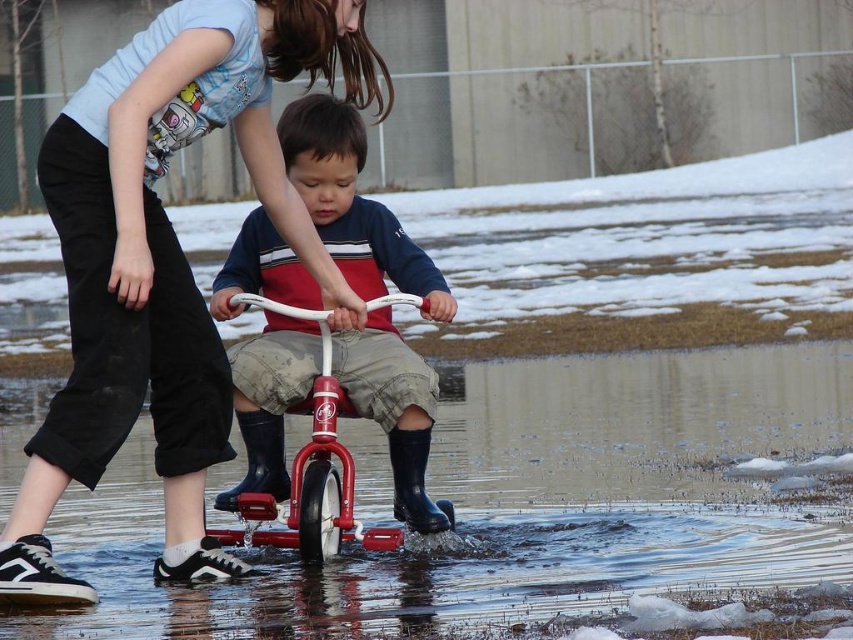
Is clear water at lower center above matte black pants at lower left?

No.

Which is more to the right, clear water at lower center or matte black pants at lower left?

clear water at lower center is more to the right.

Locate an element on the screen. clear water at lower center is located at coordinates (524, 504).

Locate an element on the screen. The image size is (853, 640). clear water at lower center is located at coordinates coord(524,504).

Between point (170, 241) and point (341, 499), which one is positioned behind?

Positioned behind is point (341, 499).

Is point (297, 220) behind point (260, 509)?

That is False.

The width and height of the screenshot is (853, 640). Find the location of `matte black pants at lower left`. matte black pants at lower left is located at coordinates (166, 259).

Between clear water at lower center and metallic red bicycle at center, which one has less height?

Standing shorter between the two is clear water at lower center.

Does point (334, 563) come farther from viewer compared to point (297, 506)?

Yes.

Is point (181, 632) closer to camera compared to point (328, 353)?

Yes, it is.

The width and height of the screenshot is (853, 640). Identify the location of clear water at lower center. (524, 504).